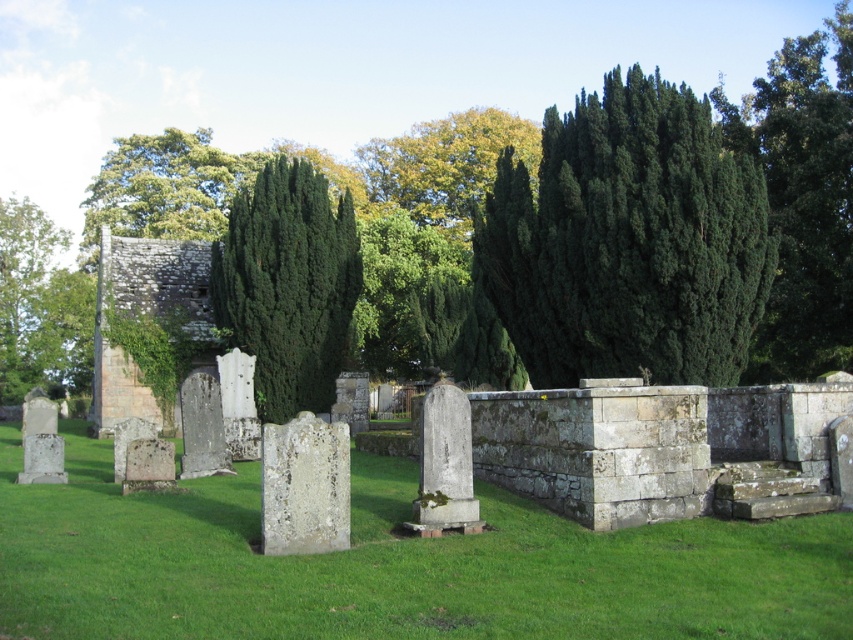
Question: Among these points, which one is nearest to the camera?

Choices:
 (A) click(x=273, y=496)
 (B) click(x=334, y=326)
 (C) click(x=248, y=173)

Answer: (A)

Question: Can you confirm if green grass at center is thinner than green leafy tree at center?

Choices:
 (A) no
 (B) yes

Answer: (A)

Question: Can you confirm if green leafy tree at upper right is positioned to the right of green leafy tree at upper left?

Choices:
 (A) no
 (B) yes

Answer: (B)

Question: Does green grass at center come in front of green leafy tree at upper center?

Choices:
 (A) no
 (B) yes

Answer: (B)

Question: Which object is positioned closest to the green leafy tree at upper center?

Choices:
 (A) white stone gravestone at center
 (B) green leafy tree at upper left

Answer: (A)

Question: Among these points, which one is nearest to the camera?

Choices:
 (A) (223, 225)
 (B) (827, 349)
 (C) (281, 273)
 (D) (329, 483)

Answer: (D)